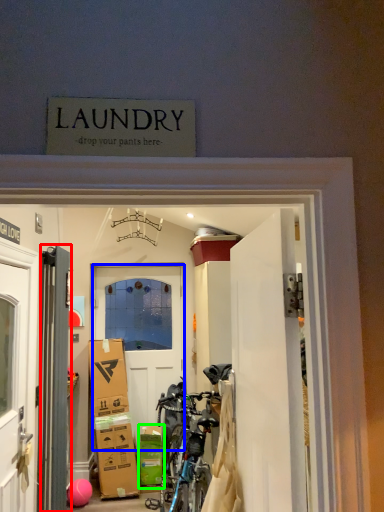
Question: Considering the real-world distances, which object is farthest from door (highlighted by a red box)? door (highlighted by a blue box) or cardboard box (highlighted by a green box)?

Choices:
 (A) door
 (B) cardboard box

Answer: (A)